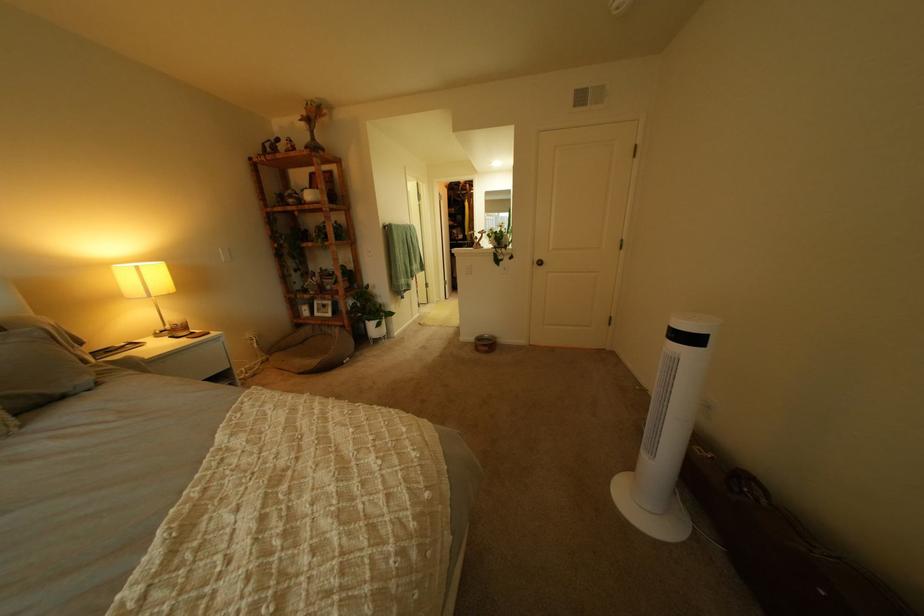
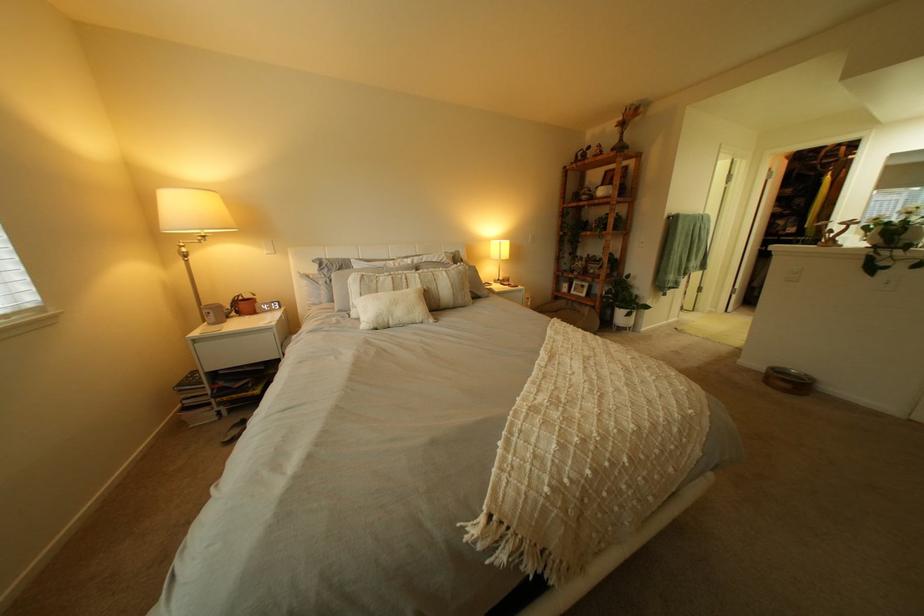
In the second image, find the point that corresponds to point 489,339 in the first image.

(779, 369)